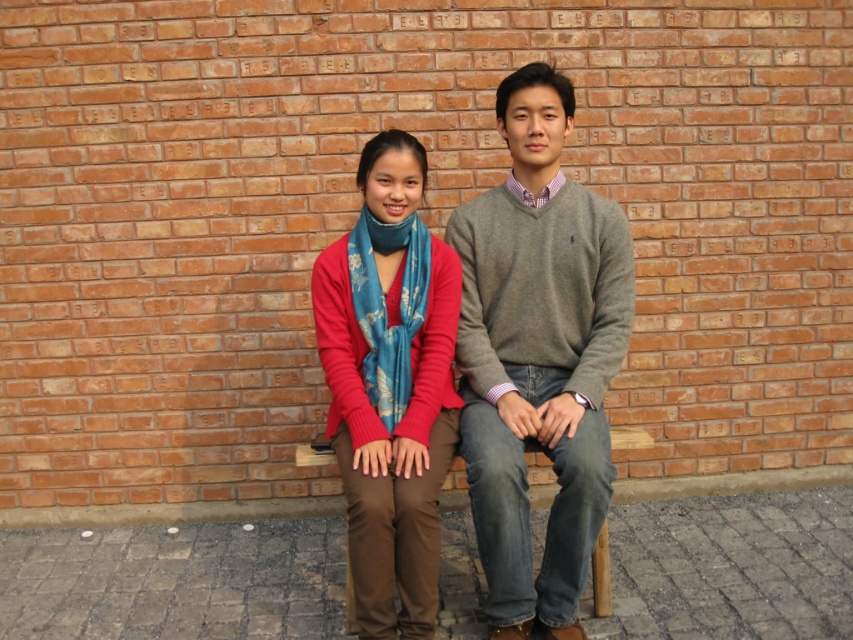
You are a photographer trying to capture a closeup of the gray sweater at center and the matte blue scarf at center. Which object should you zoom in on if you want to focus on the wider one?

The gray sweater at center might be wider than matte blue scarf at center, so you should zoom in on the gray sweater at center to focus on the wider one.

You are a fashion designer observing the two individuals seated against the brick wall. You need to determine which item of clothing is taller between the gray sweater at center and the matte blue scarf at center. Based on their positions, can you tell which one is taller?

The gray sweater at center is much taller as matte blue scarf at center, so the gray sweater at center is taller.

You are standing at the origin of the coordinate system in the image. Which of the two points, point (555, 172) or point (346, 435), is located further away from you?

Point (555, 172) is behind point (346, 435), so it is further away from you.